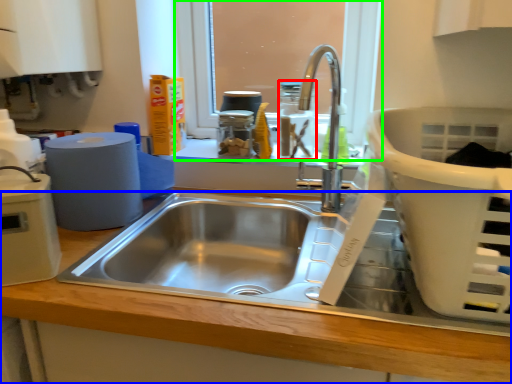
Question: Estimate the real-world distances between objects in this image. Which object is farther from bottle (highlighted by a red box), counter top (highlighted by a blue box) or window screen (highlighted by a green box)?

Choices:
 (A) counter top
 (B) window screen

Answer: (A)